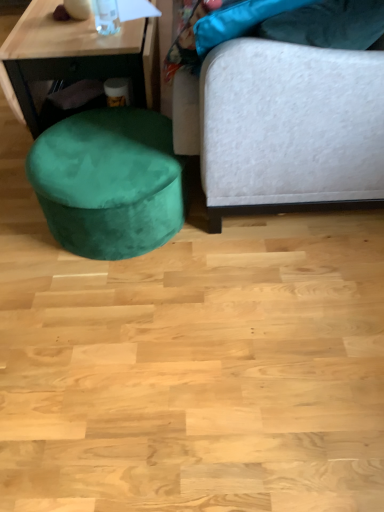
Question: Considering the relative sizes of velvet white studio couch at right and velvet green ottoman at lower left in the image provided, is velvet white studio couch at right taller than velvet green ottoman at lower left?

Choices:
 (A) no
 (B) yes

Answer: (B)

Question: Is velvet white studio couch at right to the left of velvet green ottoman at lower left from the viewer's perspective?

Choices:
 (A) yes
 (B) no

Answer: (B)

Question: Does velvet white studio couch at right have a smaller size compared to velvet green ottoman at lower left?

Choices:
 (A) no
 (B) yes

Answer: (A)

Question: Is there a large distance between velvet white studio couch at right and velvet green ottoman at lower left?

Choices:
 (A) no
 (B) yes

Answer: (A)

Question: From the image's perspective, is velvet white studio couch at right on top of velvet green ottoman at lower left?

Choices:
 (A) yes
 (B) no

Answer: (A)

Question: Is velvet white studio couch at right oriented towards velvet green ottoman at lower left?

Choices:
 (A) no
 (B) yes

Answer: (B)

Question: Is velvet green ottoman at lower left smaller than transparent glass bottle at upper left?

Choices:
 (A) yes
 (B) no

Answer: (B)

Question: Considering the relative positions of velvet green ottoman at lower left and transparent glass bottle at upper left in the image provided, is velvet green ottoman at lower left to the right of transparent glass bottle at upper left from the viewer's perspective?

Choices:
 (A) no
 (B) yes

Answer: (A)

Question: Is velvet green ottoman at lower left taller than transparent glass bottle at upper left?

Choices:
 (A) yes
 (B) no

Answer: (A)

Question: Are velvet green ottoman at lower left and transparent glass bottle at upper left making contact?

Choices:
 (A) no
 (B) yes

Answer: (A)

Question: Could you tell me if velvet green ottoman at lower left is turned towards transparent glass bottle at upper left?

Choices:
 (A) yes
 (B) no

Answer: (B)

Question: From the image's perspective, would you say velvet green ottoman at lower left is shown under transparent glass bottle at upper left?

Choices:
 (A) no
 (B) yes

Answer: (B)

Question: Is transparent glass bottle at upper left smaller than velvet green ottoman at lower left?

Choices:
 (A) yes
 (B) no

Answer: (A)